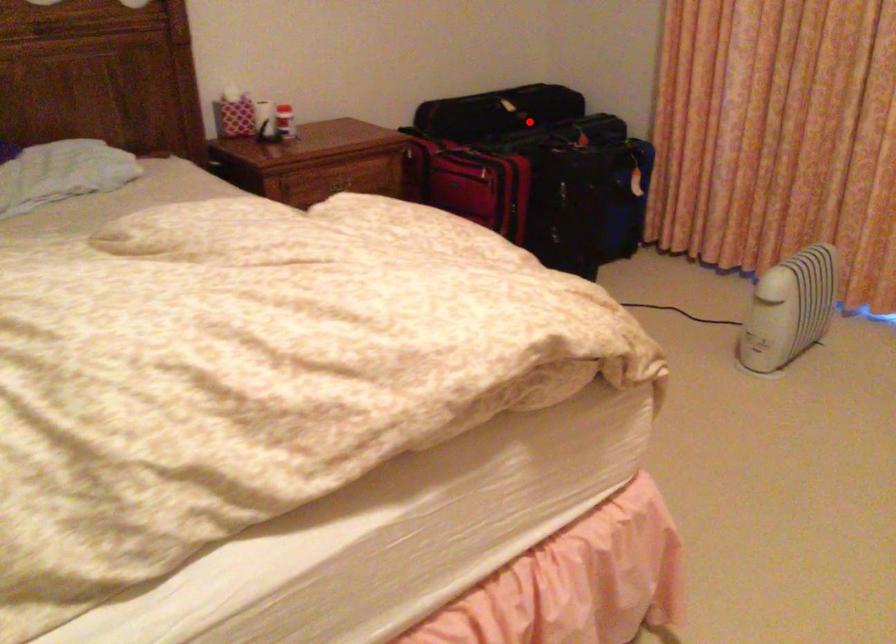
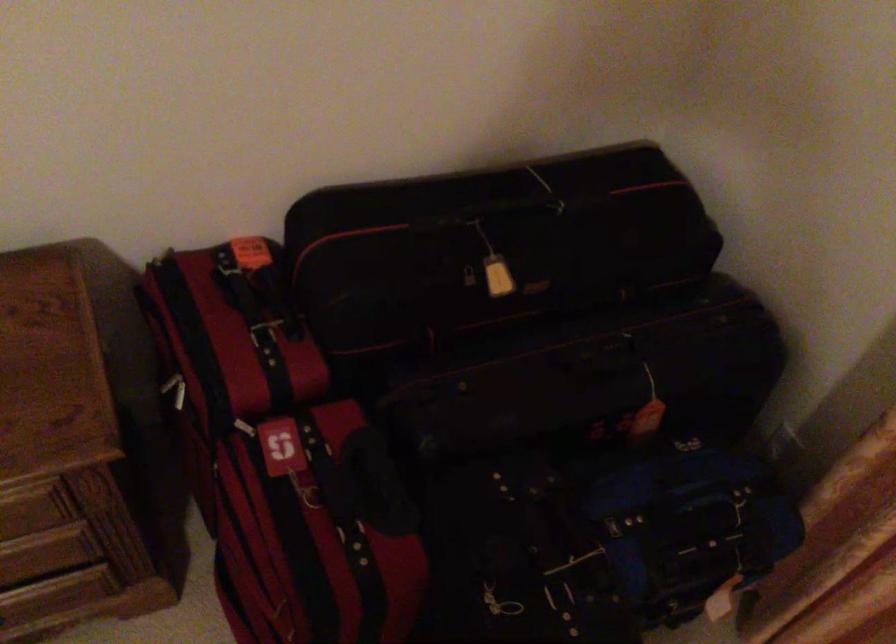
Locate, in the second image, the point that corresponds to the highlighted location in the first image.

(527, 357)